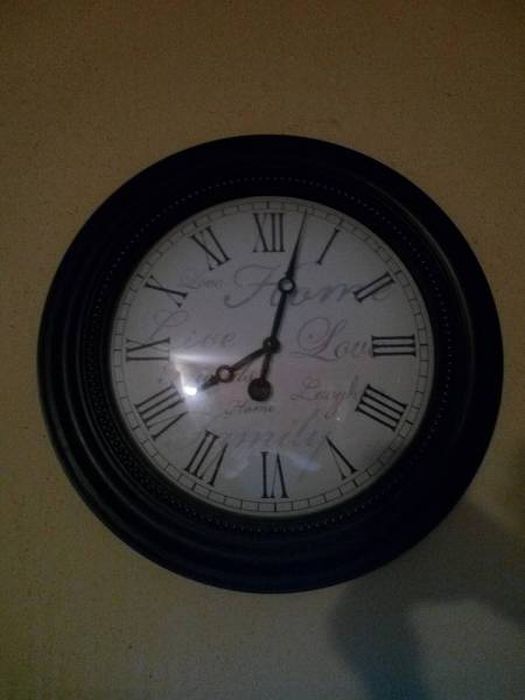
You are a GUI agent. You are given a task and a screenshot of the screen. Output one action in this format:
    pyautogui.click(x=<x>, y=<y>)
    Task: Click on the blank canvas
    The image size is (525, 700).
    Given the screenshot: What is the action you would take?
    pyautogui.click(x=76, y=603)